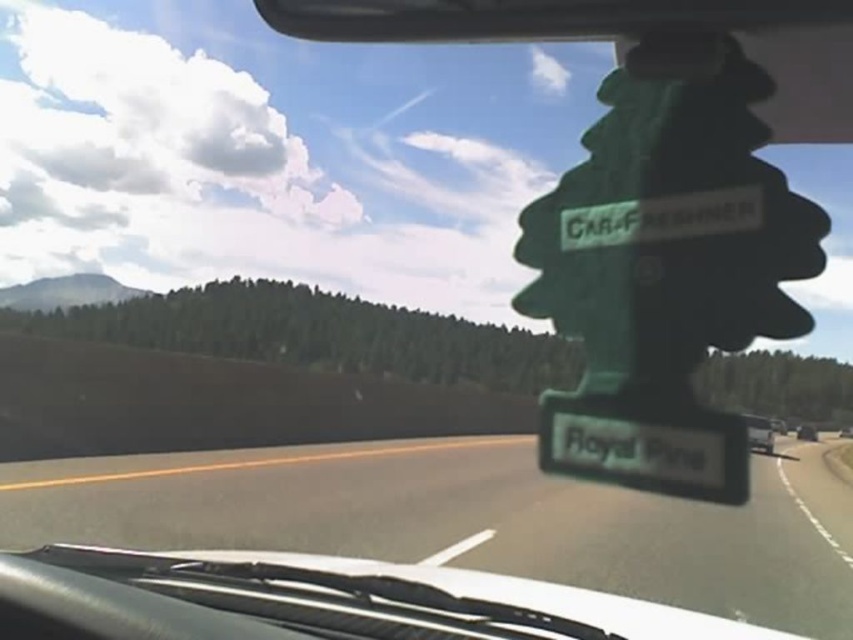
Question: Which point is farther to the camera?

Choices:
 (A) (759, 419)
 (B) (431, 534)

Answer: (A)

Question: Does black asphalt highway at center have a smaller size compared to metallic silver van at center?

Choices:
 (A) yes
 (B) no

Answer: (B)

Question: Is black asphalt highway at center to the right of metallic silver van at center from the viewer's perspective?

Choices:
 (A) no
 (B) yes

Answer: (A)

Question: Which of the following is the closest to the observer?

Choices:
 (A) (398, 476)
 (B) (770, 445)

Answer: (A)

Question: Can you confirm if black asphalt highway at center is positioned above metallic silver van at center?

Choices:
 (A) no
 (B) yes

Answer: (B)